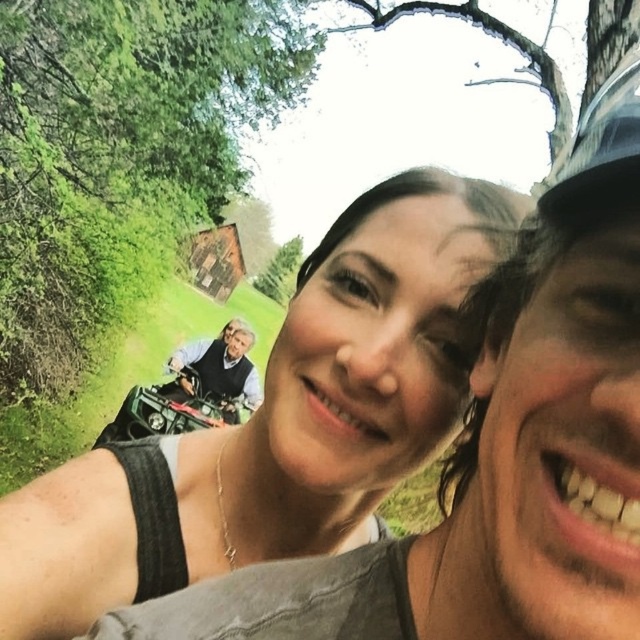
Does matte black tank top at center come behind light brown leather jacket at center?

No, it is in front of light brown leather jacket at center.

Is point (464, 371) behind point (248, 328)?

No, it is in front of (248, 328).

Which is in front, point (20, 518) or point (237, 372)?

Point (20, 518) is in front.

This screenshot has width=640, height=640. I want to click on matte black tank top at center, so click(x=276, y=422).